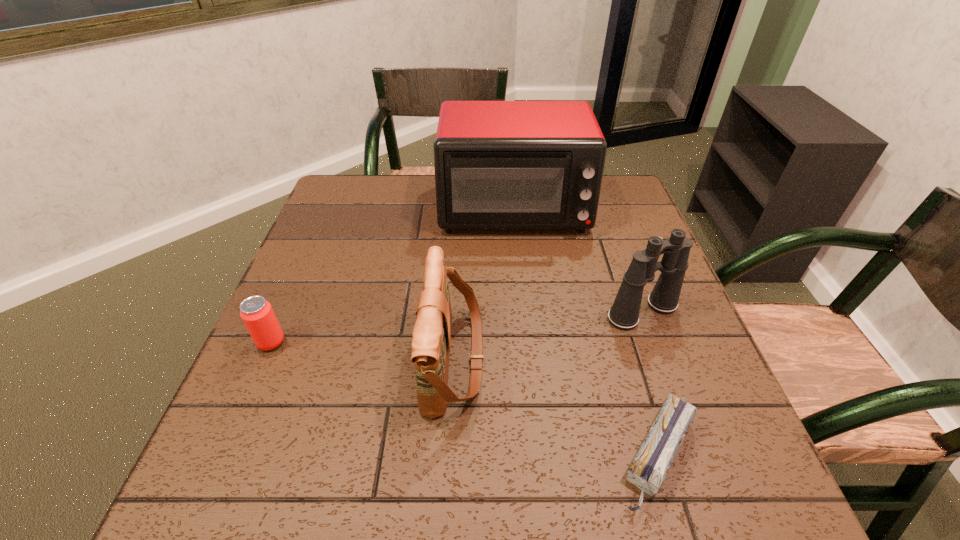
I want to click on vacant space located on the front of the leftmost object, so click(x=226, y=447).

Identify the location of free space located on the back of the shortest object. (603, 272).

I want to click on object located in the far edge section of the desktop, so click(x=498, y=164).

Where is `object that is at the near edge`? Image resolution: width=960 pixels, height=540 pixels. object that is at the near edge is located at coordinates (648, 470).

Find the location of a particular element. The image size is (960, 540). object located in the left edge section of the desktop is located at coordinates (257, 314).

Locate an element on the screen. This screenshot has height=540, width=960. toaster oven at the right edge is located at coordinates (498, 164).

This screenshot has width=960, height=540. What are the coordinates of `binoculars positioned at the right edge` in the screenshot? It's located at (624, 314).

This screenshot has height=540, width=960. Find the location of `pencil box that is at the right edge`. pencil box that is at the right edge is located at coordinates (648, 470).

In order to click on object that is at the far right corner in this screenshot , I will do `click(498, 164)`.

Where is `object that is at the near right corner`? The width and height of the screenshot is (960, 540). object that is at the near right corner is located at coordinates 648,470.